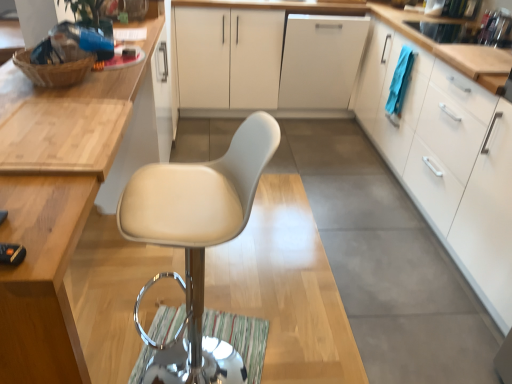
Question: Should I look upward or downward to see white matte cabinet at center, acting as the second cabinetry starting from the right?

Choices:
 (A) up
 (B) down

Answer: (A)

Question: Considering the relative positions of matte wood cabinet at upper left, positioned as the 3th cabinetry in right-to-left order, and white matte cabinet at center, acting as the second cabinetry starting from the right, in the image provided, is matte wood cabinet at upper left, positioned as the 3th cabinetry in right-to-left order, behind white matte cabinet at center, acting as the second cabinetry starting from the right,?

Choices:
 (A) yes
 (B) no

Answer: (B)

Question: Considering the relative sizes of matte wood cabinet at upper left, positioned as the 3th cabinetry in right-to-left order, and white matte cabinet at center, positioned as the 2th cabinetry in left-to-right order, in the image provided, is matte wood cabinet at upper left, positioned as the 3th cabinetry in right-to-left order, shorter than white matte cabinet at center, positioned as the 2th cabinetry in left-to-right order,?

Choices:
 (A) no
 (B) yes

Answer: (A)

Question: From a real-world perspective, does matte wood cabinet at upper left, the first cabinetry from the left, stand above white matte cabinet at center, acting as the second cabinetry starting from the right?

Choices:
 (A) yes
 (B) no

Answer: (A)

Question: Is matte wood cabinet at upper left, the first cabinetry from the left, outside white matte cabinet at center, positioned as the 2th cabinetry in left-to-right order?

Choices:
 (A) no
 (B) yes

Answer: (B)

Question: Is matte wood cabinet at upper left, positioned as the 3th cabinetry in right-to-left order, directly adjacent to white matte cabinet at center, acting as the second cabinetry starting from the right?

Choices:
 (A) no
 (B) yes

Answer: (A)

Question: Is matte wood cabinet at upper left, positioned as the 3th cabinetry in right-to-left order, positioned with its back to white matte cabinet at center, acting as the second cabinetry starting from the right?

Choices:
 (A) no
 (B) yes

Answer: (A)

Question: Is white matte cabinet at center surrounded by white matte cabinet at center, acting as the second cabinetry starting from the right?

Choices:
 (A) no
 (B) yes

Answer: (B)

Question: From a real-world perspective, is white matte cabinet at center, positioned as the 2th cabinetry in left-to-right order, located higher than white matte cabinet at center?

Choices:
 (A) no
 (B) yes

Answer: (B)

Question: Could you tell me if white matte cabinet at center, acting as the second cabinetry starting from the right, is turned towards white matte cabinet at center?

Choices:
 (A) yes
 (B) no

Answer: (A)

Question: Considering the relative sizes of white matte cabinet at center, positioned as the 2th cabinetry in left-to-right order, and white matte cabinet at center in the image provided, is white matte cabinet at center, positioned as the 2th cabinetry in left-to-right order, smaller than white matte cabinet at center?

Choices:
 (A) no
 (B) yes

Answer: (A)

Question: From a real-world perspective, is white matte cabinet at center, positioned as the 2th cabinetry in left-to-right order, located beneath white matte cabinet at center?

Choices:
 (A) no
 (B) yes

Answer: (A)

Question: Would you say white matte cabinet at center, acting as the second cabinetry starting from the right, is outside white matte cabinet at center?

Choices:
 (A) yes
 (B) no

Answer: (B)

Question: From the image's perspective, does white matte cabinet at center appear lower than white matte cabinet at right, which is the third cabinetry in left-to-right order?

Choices:
 (A) no
 (B) yes

Answer: (A)